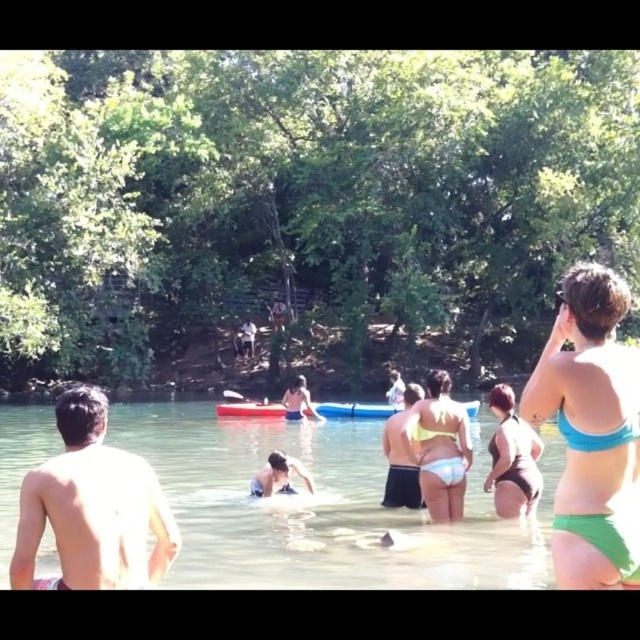
Question: Which of the following is the farthest from the observer?

Choices:
 (A) (250, 401)
 (B) (563, 435)

Answer: (A)

Question: Observing the image, what is the correct spatial positioning of blue matte bikini top at upper right in reference to light blue fabric swimsuit at center?

Choices:
 (A) below
 (B) above

Answer: (B)

Question: Which point appears closest to the camera in this image?

Choices:
 (A) (630, 417)
 (B) (580, 506)

Answer: (A)

Question: Does yellow bikini bottom at center have a larger size compared to light blue fabric swim trunks at center?

Choices:
 (A) no
 (B) yes

Answer: (B)

Question: Does light blue fabric swimsuit at center appear under white plastic paddle at center?

Choices:
 (A) no
 (B) yes

Answer: (A)

Question: Which object is the closest to the green bikini bottom at right?

Choices:
 (A) yellow bikini bottom at center
 (B) blue matte bikini top at upper right
 (C) light blue fabric swimsuit at center
 (D) white plastic paddle at center

Answer: (A)